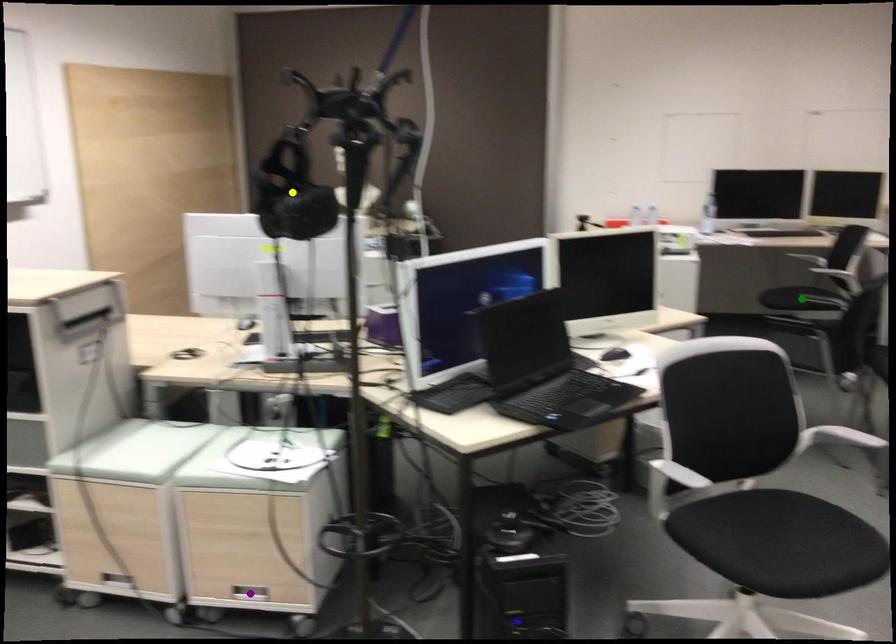
Order these from nearest to farthest:
yellow point, green point, purple point

yellow point
purple point
green point